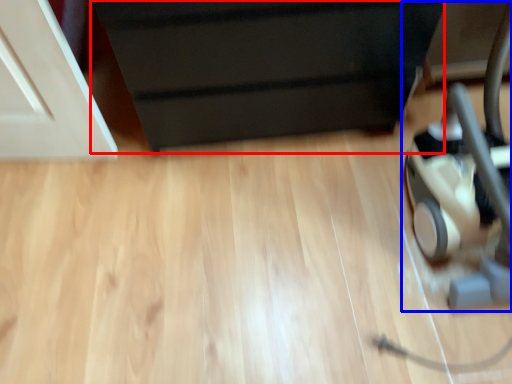
Question: Which point is further to the camera, furniture (highlighted by a red box) or baby carriage (highlighted by a blue box)?

Choices:
 (A) furniture
 (B) baby carriage

Answer: (A)